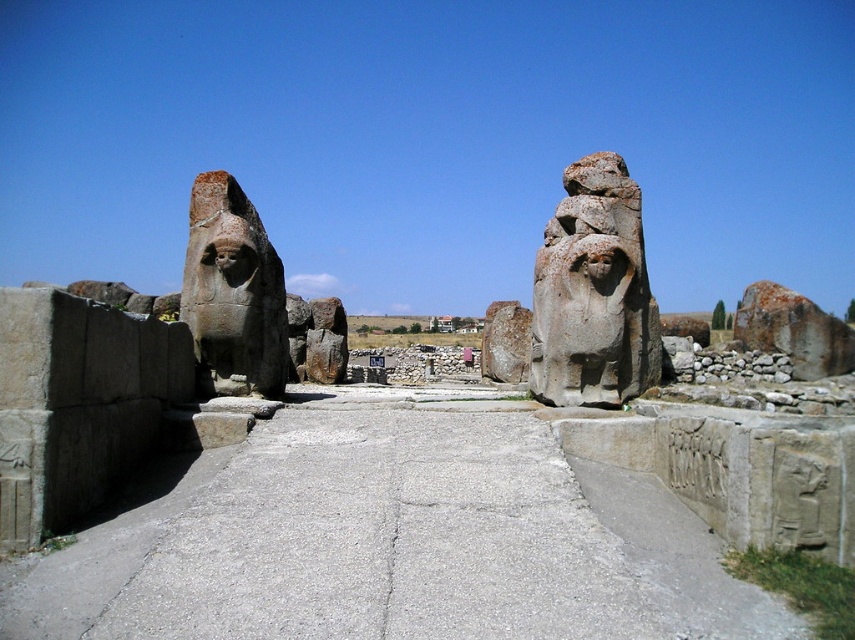
Question: Which point appears closest to the camera in this image?

Choices:
 (A) (585, 390)
 (B) (337, 376)
 (C) (286, 557)
 (D) (201, 342)

Answer: (C)

Question: Can you confirm if gray concrete pavement at center is positioned to the right of brown stone statue at center?

Choices:
 (A) no
 (B) yes

Answer: (B)

Question: Does gray stone lion at center appear on the left side of brown stone statue at center?

Choices:
 (A) yes
 (B) no

Answer: (B)

Question: Can you confirm if gray stone lion at center is bigger than brown stone statue at left?

Choices:
 (A) no
 (B) yes

Answer: (B)

Question: Which point appears closest to the camera in this image?

Choices:
 (A) (624, 269)
 (B) (282, 353)
 (C) (95, 529)

Answer: (C)

Question: Which point is farther to the camera?

Choices:
 (A) gray stone lion at center
 (B) gray concrete pavement at center

Answer: (A)